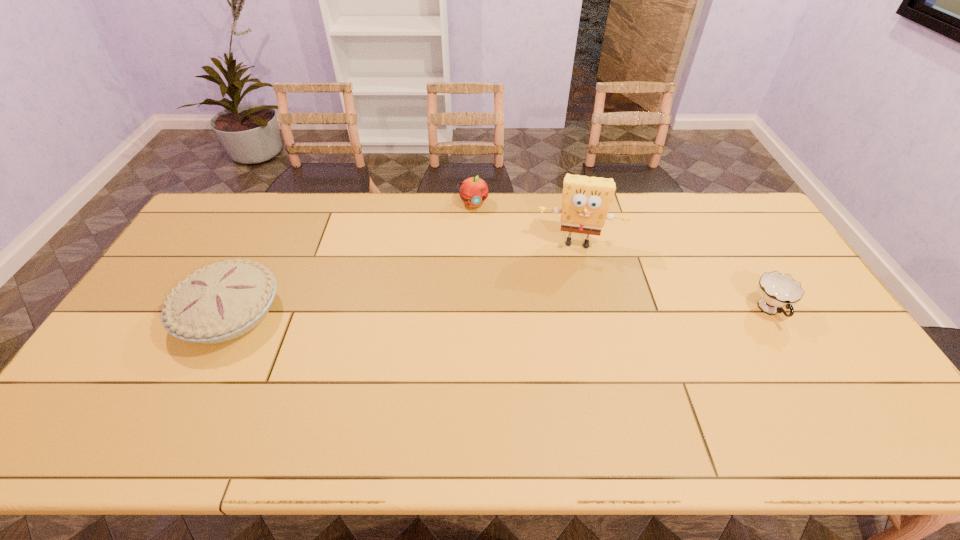
Find the location of `empty space that is in between the tallest object and the cup`. empty space that is in between the tallest object and the cup is located at coordinates (674, 276).

The width and height of the screenshot is (960, 540). I want to click on unoccupied position between the farthest object and the leftmost object, so click(x=351, y=258).

The image size is (960, 540). I want to click on free point between the cup and the farthest object, so click(621, 257).

I want to click on vacant space that is in between the third nearest object and the farthest object, so click(525, 222).

Identify which object is located as the second nearest to the tallest object. Please provide its 2D coordinates. Your answer should be formatted as a tuple, i.e. [(x, y)], where the tuple contains the x and y coordinates of a point satisfying the conditions above.

[(776, 290)]

Identify which object is the closest to the leftmost object. Please provide its 2D coordinates. Your answer should be formatted as a tuple, i.e. [(x, y)], where the tuple contains the x and y coordinates of a point satisfying the conditions above.

[(473, 191)]